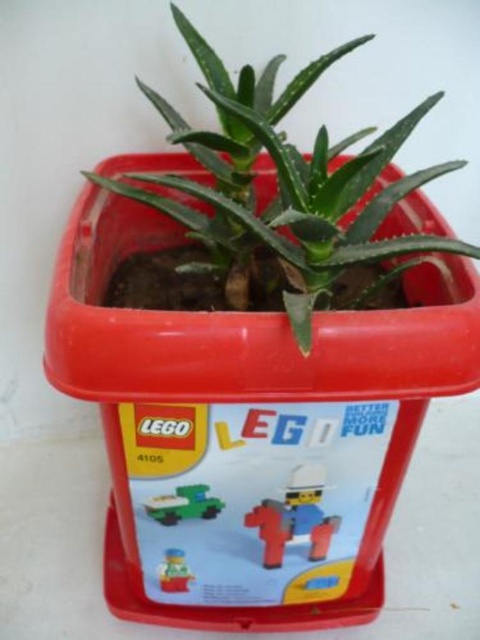
Describe the element at coordinates (283, 184) in the screenshot. This screenshot has height=640, width=480. I see `green matte plant at center` at that location.

Between green matte plant at center and matte yellow plastic toy at center, which one is positioned higher?

Positioned higher is green matte plant at center.

You are a GUI agent. You are given a task and a screenshot of the screen. Output one action in this format:
    pyautogui.click(x=<x>, y=<y>)
    Task: Click on the green matte plant at center
    The width and height of the screenshot is (480, 640).
    Given the screenshot: What is the action you would take?
    pyautogui.click(x=283, y=184)

Looking at this image, is green matte plant at center positioned at the back of matte plastic cowboy at center?

No, green matte plant at center is closer to the viewer.

Is point (175, 120) positioned in front of point (275, 545)?

Yes, it is in front of point (275, 545).

Where is `green matte plant at center`? green matte plant at center is located at coordinates (283, 184).

Who is positioned more to the left, green matte plant at center or green matte toy car at center?

green matte toy car at center

At what (x,y) coordinates should I click in order to perform the action: click on green matte plant at center. Please return your answer as a coordinate pair (x, y). Looking at the image, I should click on (283, 184).

Locate an element on the screen. green matte plant at center is located at coordinates (283, 184).